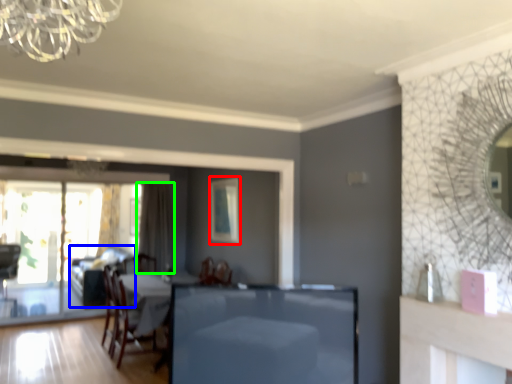
Question: Estimate the real-world distances between objects in this image. Which object is closer to picture frame (highlighted by a red box), couch (highlighted by a blue box) or curtain (highlighted by a green box)?

Choices:
 (A) couch
 (B) curtain

Answer: (B)